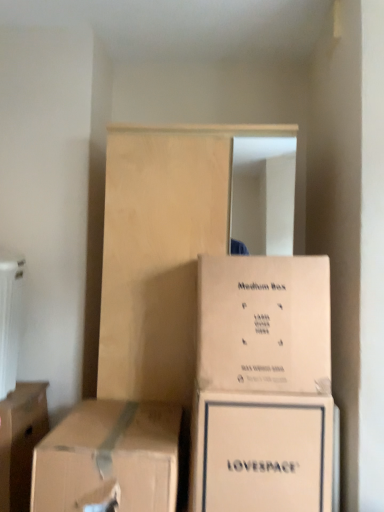
Question: Can you confirm if light wood dresser at center is shorter than brown cardboard box at lower left, arranged as the first box when viewed from the left?

Choices:
 (A) no
 (B) yes

Answer: (A)

Question: Is light wood dresser at center looking in the opposite direction of brown cardboard box at lower left, arranged as the first box when viewed from the left?

Choices:
 (A) yes
 (B) no

Answer: (B)

Question: Is light wood dresser at center positioned behind brown cardboard box at lower left, the fourth box viewed from the right?

Choices:
 (A) yes
 (B) no

Answer: (A)

Question: Is light wood dresser at center facing towards brown cardboard box at lower left, arranged as the first box when viewed from the left?

Choices:
 (A) yes
 (B) no

Answer: (B)

Question: Is light wood dresser at center taller than brown cardboard box at lower left, arranged as the first box when viewed from the left?

Choices:
 (A) no
 (B) yes

Answer: (B)

Question: Is brown cardboard box at lower left, acting as the 2th box starting from the left, taller or shorter than brown cardboard box at lower left, the fourth box viewed from the right?

Choices:
 (A) short
 (B) tall

Answer: (A)

Question: Considering their positions, is brown cardboard box at lower left, acting as the 2th box starting from the left, located in front of or behind brown cardboard box at lower left, the fourth box viewed from the right?

Choices:
 (A) behind
 (B) front

Answer: (B)

Question: From a real-world perspective, relative to brown cardboard box at lower left, arranged as the first box when viewed from the left, is brown cardboard box at lower left, acting as the 2th box starting from the left, vertically above or below?

Choices:
 (A) above
 (B) below

Answer: (A)

Question: From the image's perspective, is brown cardboard box at lower left, arranged as the 3th box when viewed from the right, located above or below brown cardboard box at lower left, the fourth box viewed from the right?

Choices:
 (A) below
 (B) above

Answer: (B)

Question: From the image's perspective, is white cardboard box at lower center, placed as the third box when sorted from left to right, positioned above or below white plastic radiator at left?

Choices:
 (A) below
 (B) above

Answer: (A)

Question: Is white cardboard box at lower center, placed as the third box when sorted from left to right, inside or outside of white plastic radiator at left?

Choices:
 (A) inside
 (B) outside

Answer: (B)

Question: Based on their sizes in the image, would you say white cardboard box at lower center, arranged as the 2th box when viewed from the right, is bigger or smaller than white plastic radiator at left?

Choices:
 (A) small
 (B) big

Answer: (B)

Question: Considering the positions of white cardboard box at lower center, arranged as the 2th box when viewed from the right, and white plastic radiator at left in the image, is white cardboard box at lower center, arranged as the 2th box when viewed from the right, wider or thinner than white plastic radiator at left?

Choices:
 (A) thin
 (B) wide

Answer: (B)

Question: In terms of width, does light wood dresser at center look wider or thinner when compared to beige cardboard box at center, acting as the first box starting from the right?

Choices:
 (A) thin
 (B) wide

Answer: (B)

Question: Considering the positions of light wood dresser at center and beige cardboard box at center, arranged as the fourth box when viewed from the left, in the image, is light wood dresser at center taller or shorter than beige cardboard box at center, arranged as the fourth box when viewed from the left,?

Choices:
 (A) short
 (B) tall

Answer: (B)